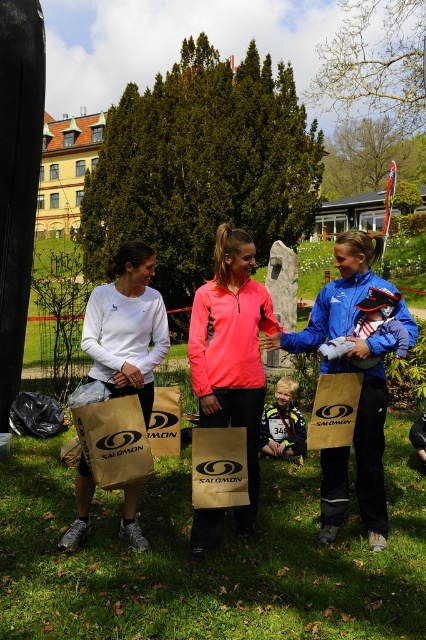
Where is the matte brown paper bag at center located in the image?

The matte brown paper bag at center is located at point (218, 467) in the image.